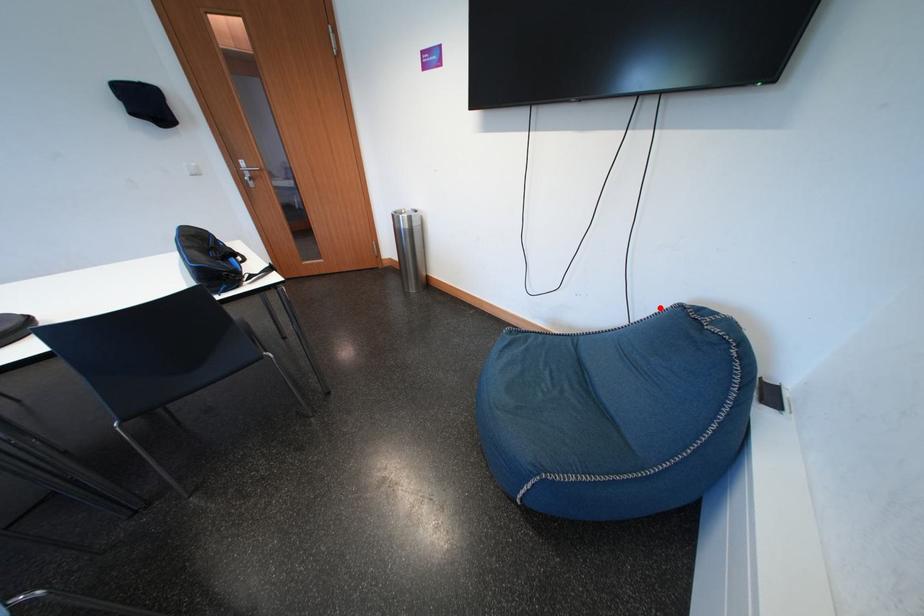
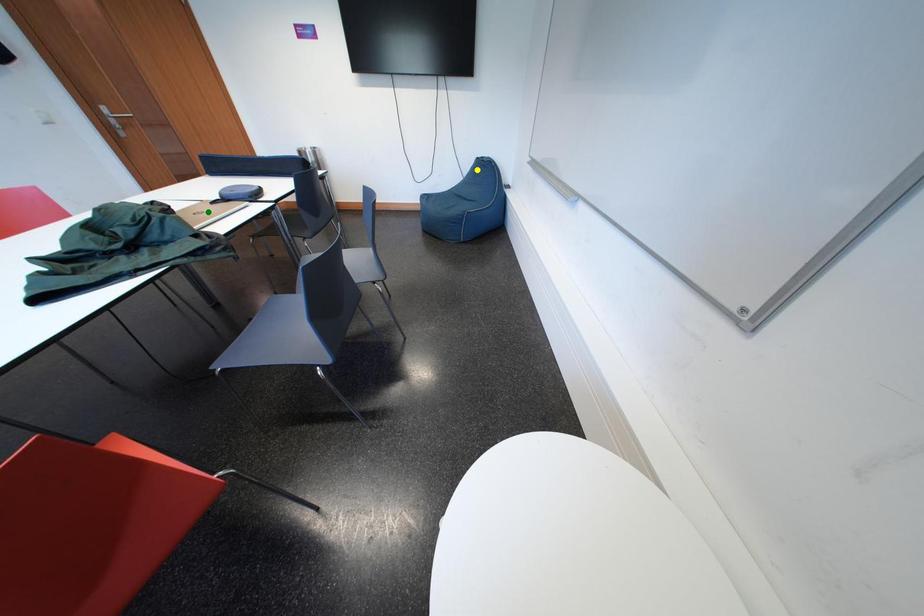
Question: I am providing you with two images of the same scene from different viewpoints. A red point is marked on the first image. You are given multiple points on the second image. In image 2, which mark is for the same physical point as the one in image 1?

Choices:
 (A) blue point
 (B) green point
 (C) yellow point

Answer: (C)